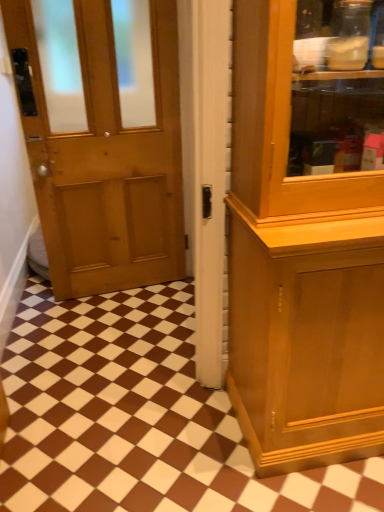
Question: Considering the relative sizes of brown glossy tile at center and matte wood door at center in the image provided, is brown glossy tile at center taller than matte wood door at center?

Choices:
 (A) no
 (B) yes

Answer: (A)

Question: Is brown glossy tile at center outside of matte wood door at center?

Choices:
 (A) yes
 (B) no

Answer: (A)

Question: Would you say matte wood door at center is part of brown glossy tile at center's contents?

Choices:
 (A) no
 (B) yes

Answer: (A)

Question: Is brown glossy tile at center to the left of matte wood door at center from the viewer's perspective?

Choices:
 (A) no
 (B) yes

Answer: (A)

Question: From the image's perspective, is brown glossy tile at center below matte wood door at center?

Choices:
 (A) yes
 (B) no

Answer: (A)

Question: Is brown glossy tile at center closer to camera compared to matte wood door at center?

Choices:
 (A) yes
 (B) no

Answer: (B)

Question: Is matte wood door at center directly adjacent to brown glossy tile at center?

Choices:
 (A) no
 (B) yes

Answer: (A)

Question: From a real-world perspective, is matte wood door at center on brown glossy tile at center?

Choices:
 (A) no
 (B) yes

Answer: (B)

Question: Are matte wood door at center and brown glossy tile at center located far from each other?

Choices:
 (A) no
 (B) yes

Answer: (A)

Question: Is matte wood door at center shorter than brown glossy tile at center?

Choices:
 (A) yes
 (B) no

Answer: (B)

Question: From a real-world perspective, does matte wood door at center sit lower than brown glossy tile at center?

Choices:
 (A) yes
 (B) no

Answer: (B)

Question: Is matte wood door at center taller than brown glossy tile at center?

Choices:
 (A) no
 (B) yes

Answer: (B)

Question: From a real-world perspective, is matte wood door at center positioned above or below brown glossy tile at center?

Choices:
 (A) above
 (B) below

Answer: (A)